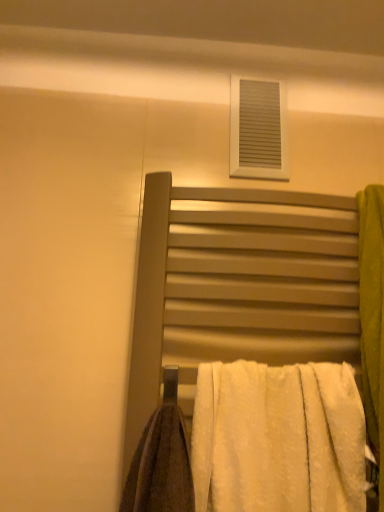
Question: In the image, is white fluffy towel at center on the left side or the right side of white matte vent at upper center?

Choices:
 (A) right
 (B) left

Answer: (B)

Question: Is white fluffy towel at center wider or thinner than white matte vent at upper center?

Choices:
 (A) thin
 (B) wide

Answer: (B)

Question: Considering the real-world distances, which object is farthest from the white fluffy towel at center?

Choices:
 (A) matte metal towel rack at center
 (B) white matte vent at upper center

Answer: (B)

Question: Which is farther from the white matte vent at upper center?

Choices:
 (A) matte metal towel rack at center
 (B) white fluffy towel at center

Answer: (B)